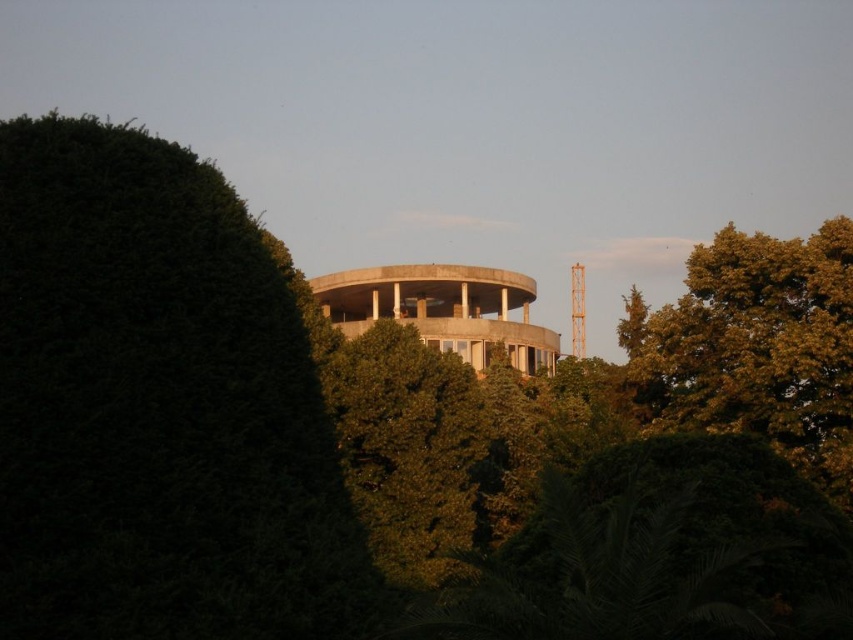
Who is taller, green leafy bush at upper left or green leafy tree at upper right?

With more height is green leafy tree at upper right.

Does point (112, 579) come farther from viewer compared to point (703, 339)?

No, (112, 579) is closer to viewer.

Is point (103, 500) more distant than point (733, 310)?

No, (103, 500) is in front of (733, 310).

Where is `green leafy bush at upper left`? The height and width of the screenshot is (640, 853). green leafy bush at upper left is located at coordinates (158, 406).